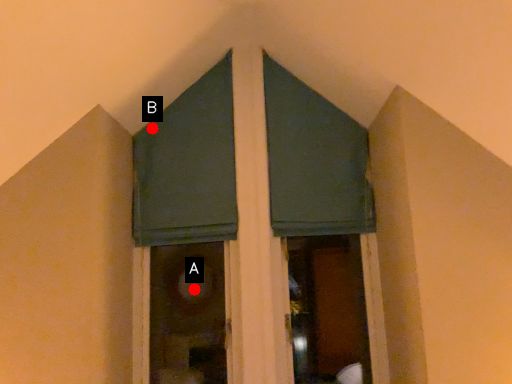
Question: Two points are circled on the image, labeled by A and B beside each circle. Among these points, which one is nearest to the camera?

Choices:
 (A) A is closer
 (B) B is closer

Answer: (B)